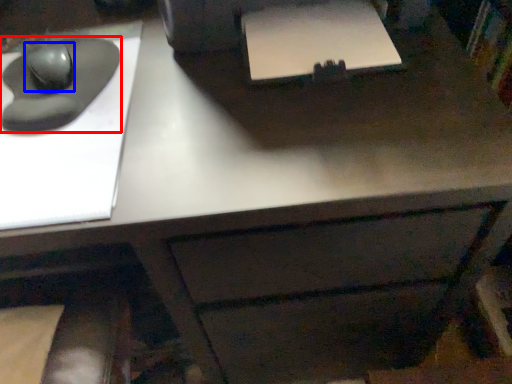
Question: Which object appears closest to the camera in this image, mouse (highlighted by a red box) or mouse (highlighted by a blue box)?

Choices:
 (A) mouse
 (B) mouse

Answer: (A)